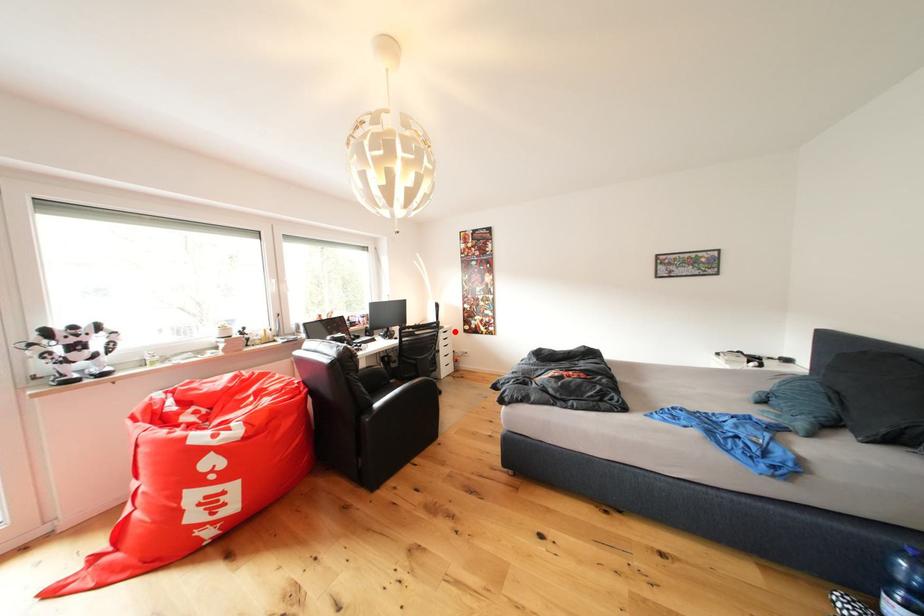
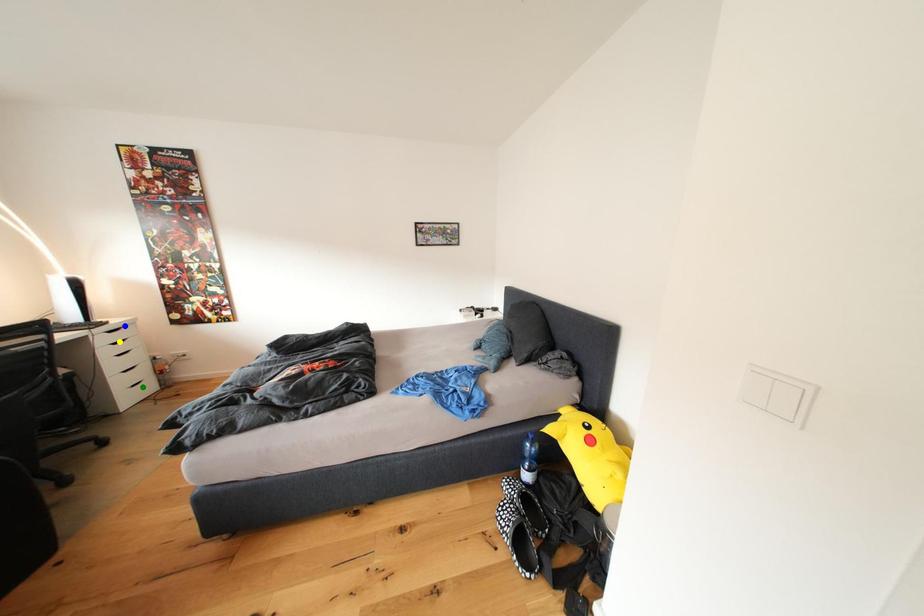
Question: I am providing you with two images of the same scene from different viewpoints. A red point is marked on the first image. You are given multiple points on the second image. Which point in image 2 represents the same 3d spot as the red point in image 1?

Choices:
 (A) green point
 (B) blue point
 (C) yellow point

Answer: (B)